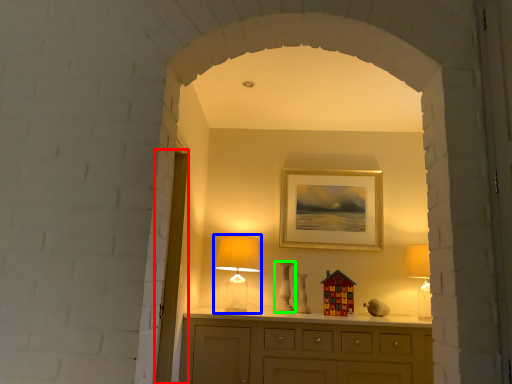
Question: Based on their relative distances, which object is nearer to glass door (highlighted by a red box)? Choose from table lamp (highlighted by a blue box) and vase (highlighted by a green box).

Choices:
 (A) table lamp
 (B) vase

Answer: (A)